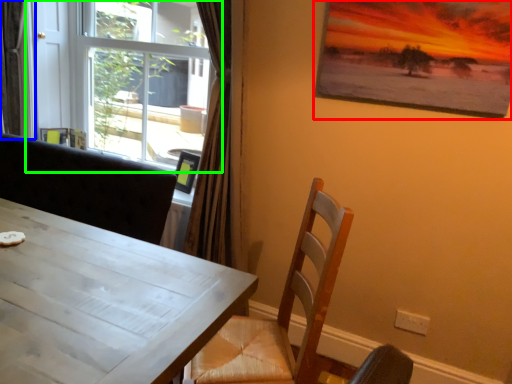
Question: Which object is the farthest from picture frame (highlighted by a red box)? Choose among these: curtain (highlighted by a blue box) or window (highlighted by a green box).

Choices:
 (A) curtain
 (B) window

Answer: (A)